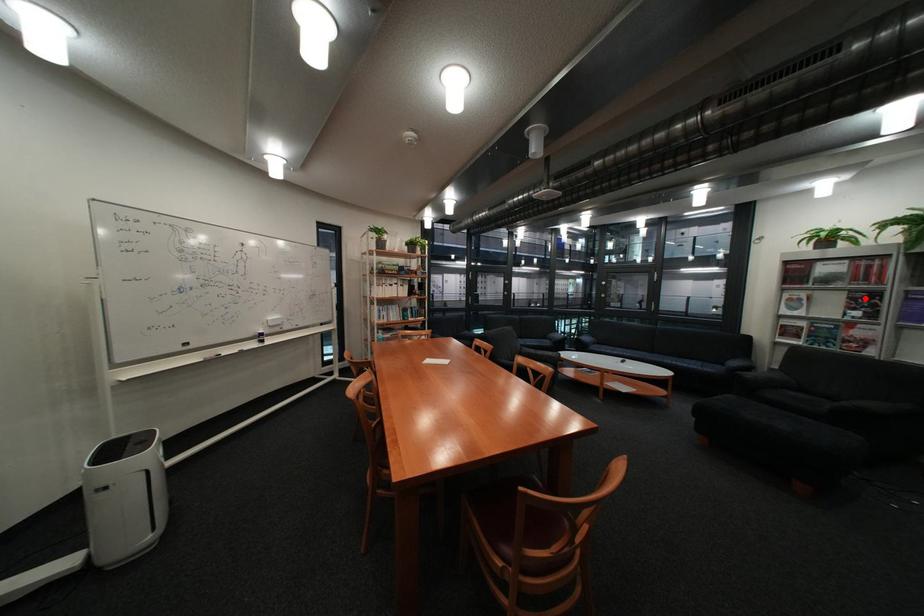
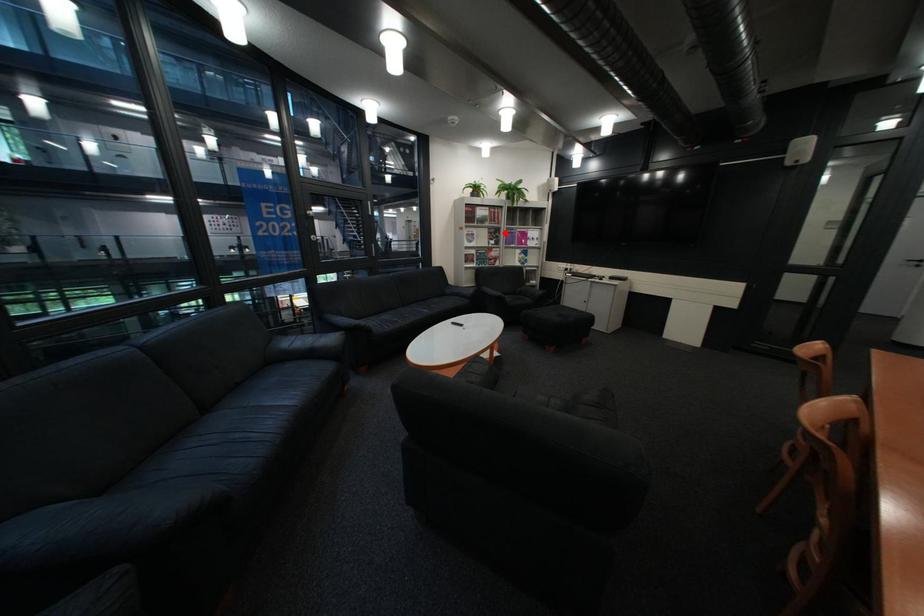
I am providing you with two images of the same scene from different viewpoints. A red point is marked on the first image and another point is marked on the second image. Is the marked point in image1 the same physical position as the marked point in image2?

Yes